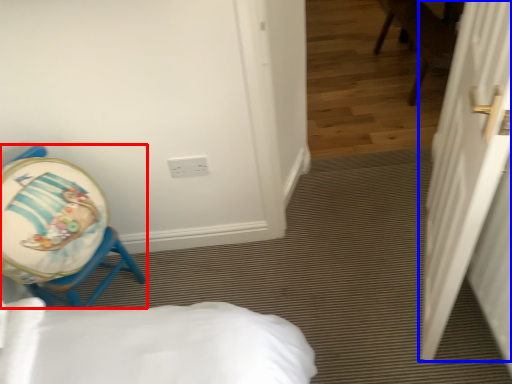
Question: Which object is closer to the camera taking this photo, chair (highlighted by a red box) or door (highlighted by a blue box)?

Choices:
 (A) chair
 (B) door

Answer: (B)